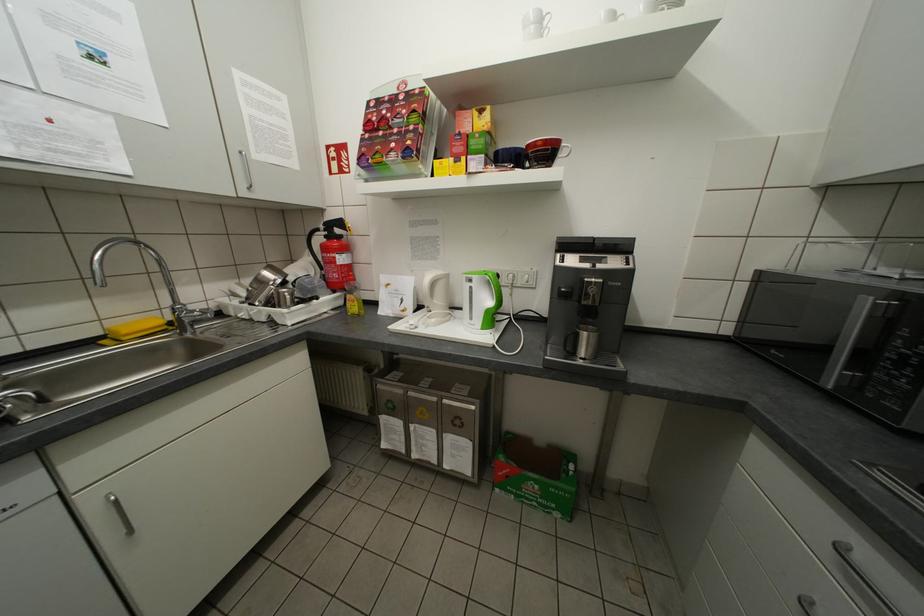
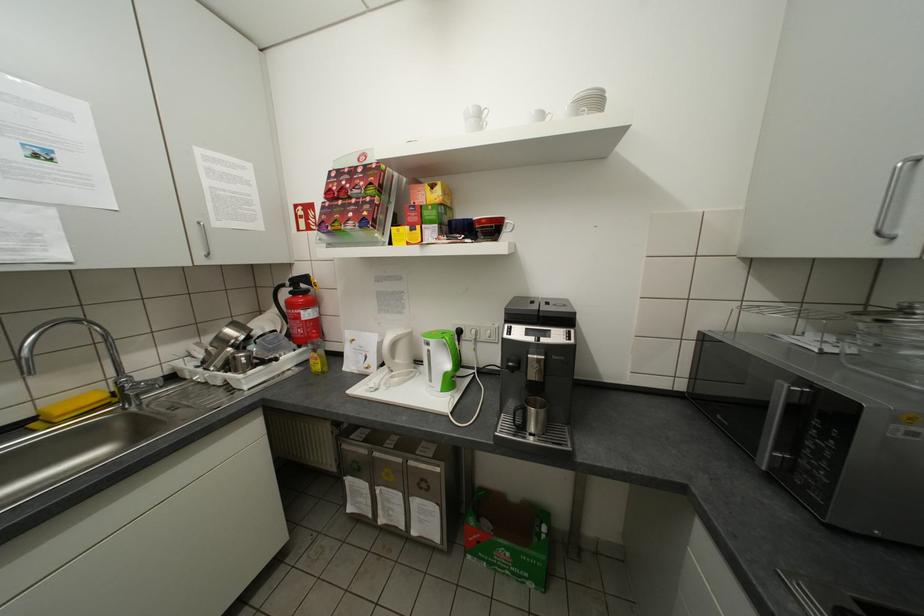
Find the pixel in the second image that matches (357,305) in the first image.

(321, 362)